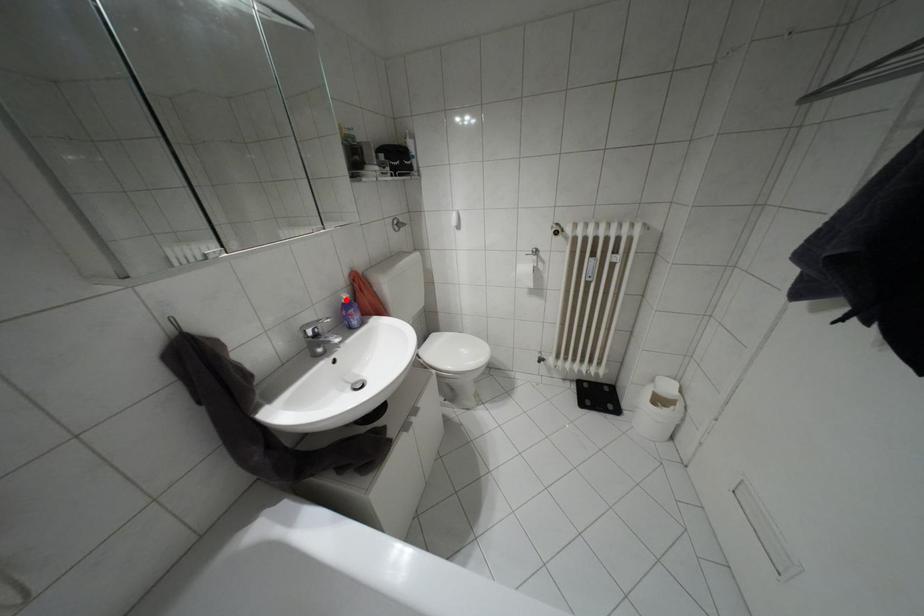
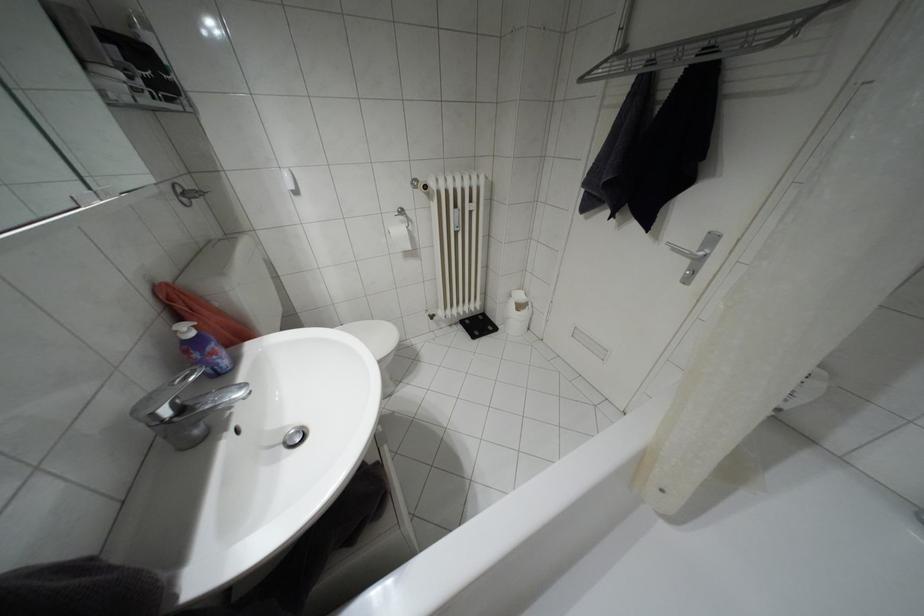
Where in the second image is the point corresponding to the highlighted location from the first image?

(190, 333)